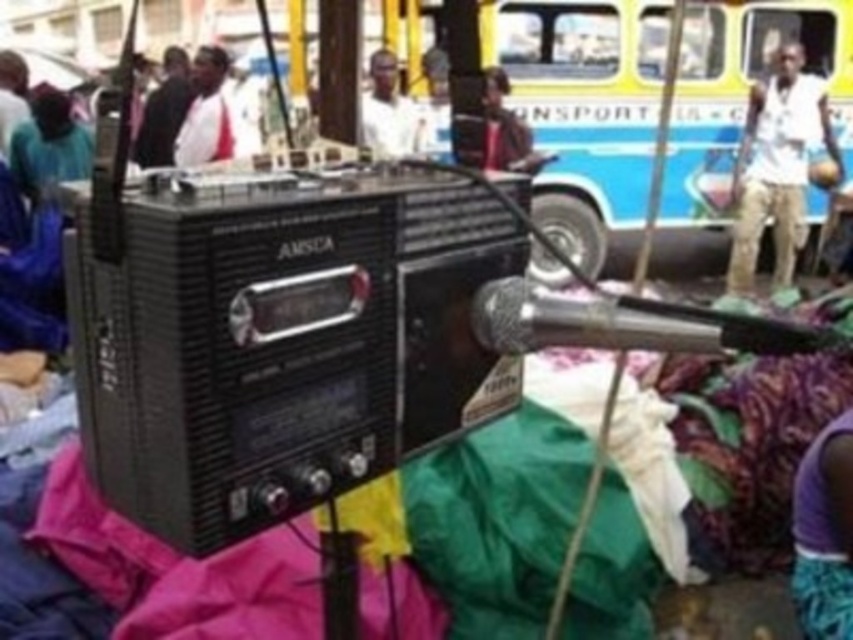
Image resolution: width=853 pixels, height=640 pixels. What do you see at coordinates (390, 113) in the screenshot? I see `white matte shirt at upper center` at bounding box center [390, 113].

Is white matte shirt at upper center closer to the viewer compared to matte brown shirt at center?

No, it is behind matte brown shirt at center.

Which is in front, point (404, 134) or point (483, 68)?

Point (483, 68)

Where is `white matte shirt at upper center`? The image size is (853, 640). white matte shirt at upper center is located at coordinates (390, 113).

Looking at this image, can you confirm if white cotton shirt at upper right is positioned above white matte shirt at upper center?

Incorrect, white cotton shirt at upper right is not positioned above white matte shirt at upper center.

Does white cotton shirt at upper right have a greater width compared to white matte shirt at upper center?

Indeed, white cotton shirt at upper right has a greater width compared to white matte shirt at upper center.

Which is behind, point (785, 147) or point (366, 132)?

Positioned behind is point (785, 147).

This screenshot has height=640, width=853. I want to click on white cotton shirt at upper right, so click(776, 164).

Can you confirm if white cotton shirt at upper right is bigger than matte brown shirt at center?

Result: Yes, white cotton shirt at upper right is bigger than matte brown shirt at center.

Between white cotton shirt at upper right and matte brown shirt at center, which one is positioned lower?

white cotton shirt at upper right

Between point (799, 115) and point (531, 148), which one is positioned in front?

Point (531, 148) is more forward.

Identify the location of white cotton shirt at upper right. (776, 164).